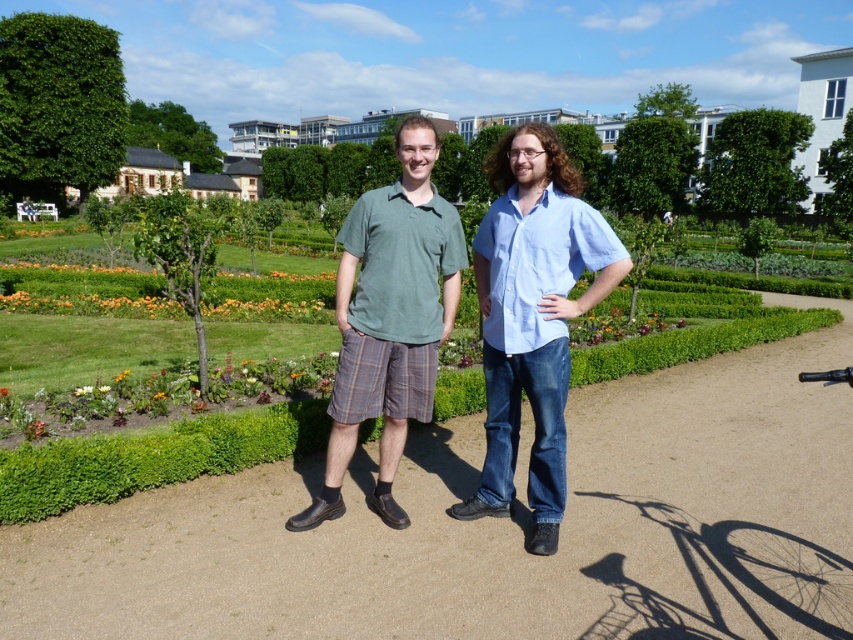
Is brown gravel path at center taller than green cotton polo shirt at center?

Incorrect, brown gravel path at center's height is not larger of green cotton polo shirt at center's.

Is brown gravel path at center closer to the viewer compared to green cotton polo shirt at center?

No, brown gravel path at center is further to the viewer.

The height and width of the screenshot is (640, 853). Identify the location of brown gravel path at center. (496, 529).

The height and width of the screenshot is (640, 853). Find the location of `brown gravel path at center`. brown gravel path at center is located at coordinates (496, 529).

Between matte green shirt at center and green cotton polo shirt at center, which one appears on the right side from the viewer's perspective?

From the viewer's perspective, matte green shirt at center appears more on the right side.

Does matte green shirt at center have a greater height compared to green cotton polo shirt at center?

Correct, matte green shirt at center is much taller as green cotton polo shirt at center.

Locate an element on the screen. This screenshot has width=853, height=640. matte green shirt at center is located at coordinates (534, 321).

Identify the location of matte green shirt at center. Image resolution: width=853 pixels, height=640 pixels. (534, 321).

Who is positioned more to the left, matte green shirt at center or green leafy hedge at upper left?

green leafy hedge at upper left

You are a GUI agent. You are given a task and a screenshot of the screen. Output one action in this format:
    pyautogui.click(x=<x>, y=<y>)
    Task: Click on the matte green shirt at center
    This screenshot has width=853, height=640.
    Given the screenshot: What is the action you would take?
    pyautogui.click(x=534, y=321)